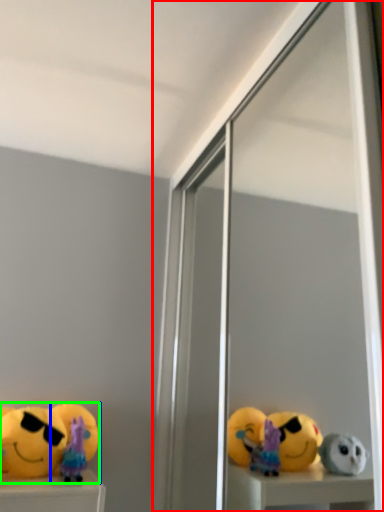
Question: Which is farther away from screen door (highlighted by a red box)? toy (highlighted by a blue box) or toy (highlighted by a green box)?

Choices:
 (A) toy
 (B) toy

Answer: (A)